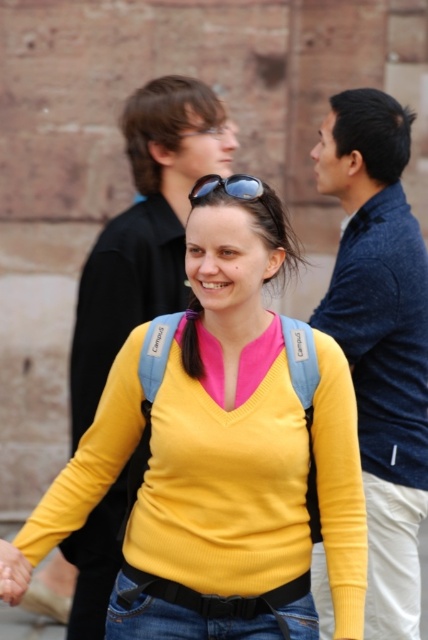
You are a photographer trying to capture a candid shot of the group. You notice the denim jacket at right and the sunglasses at center. Which object should you focus on if you want to capture the larger one in your frame?

The denim jacket at right is bigger than the sunglasses at center, so you should focus on the denim jacket at right to capture the larger one in your frame.

You are a photographer trying to capture the central figure in the image. The camera you are using has a rectangular viewfinder with a specific focus point at coordinate point (222, 452). Can you confirm if the yellow ribbed sweater at center is positioned at that focus point?

Yes, the point (222, 452) indicates the yellow ribbed sweater at center, so the focus point is correctly positioned there.

You are a photographer trying to capture a photo of the scene. You want to focus on the two points in the image labeled as point (228, 620) and point (211, 189). Which point should you adjust your focus to ensure the closer one is sharp?

Point (228, 620) is closer to the camera than point (211, 189), so you should focus on point (228, 620) to ensure the closer one is sharp.